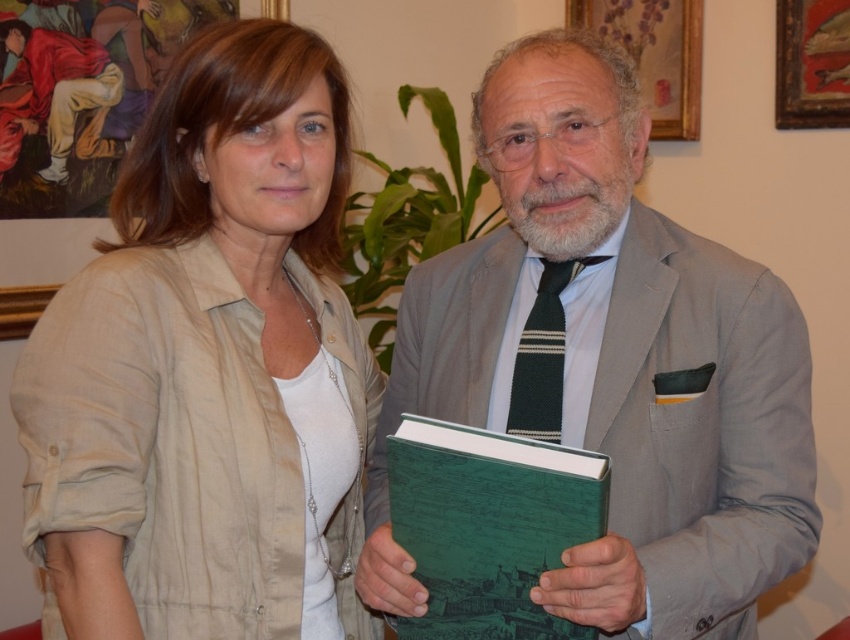
You are organizing a bookshelf and need to place the green matte book at center and the matte beige shirt at upper left. Given that the shelf has limited space, which item should you place first to ensure both fit?

The green matte book at center is bigger than the matte beige shirt at upper left, so you should place the green matte book at center first to accommodate its larger size before placing the matte beige shirt at upper left.

You are taking a photo of two people in a room. You want to focus on the person closer to the camera. Which point should you focus on, point 1 at (558, 413) or point 2 at (17, 304)?

You should focus on point 1 at (558, 413) because it is closer to the camera than point 2 at (17, 304).